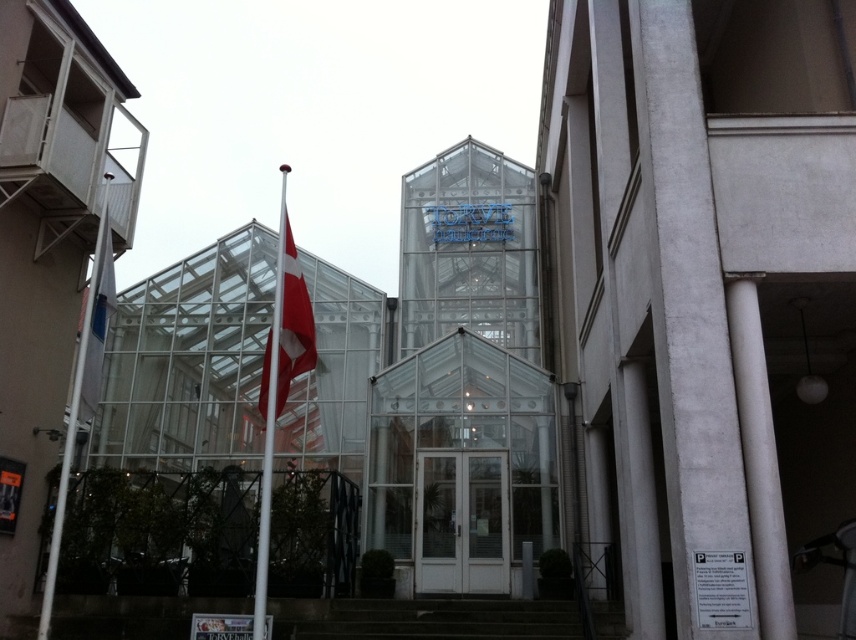
You are standing at the entrance of the building and want to walk towards the point labeled as point (419,499). However, there is an obstacle at point (266,392). Will you be able to reach your destination without going around the obstacle?

Since point (419,499) is behind point (266,392), you will encounter the obstacle first and need to go around it to reach your destination.